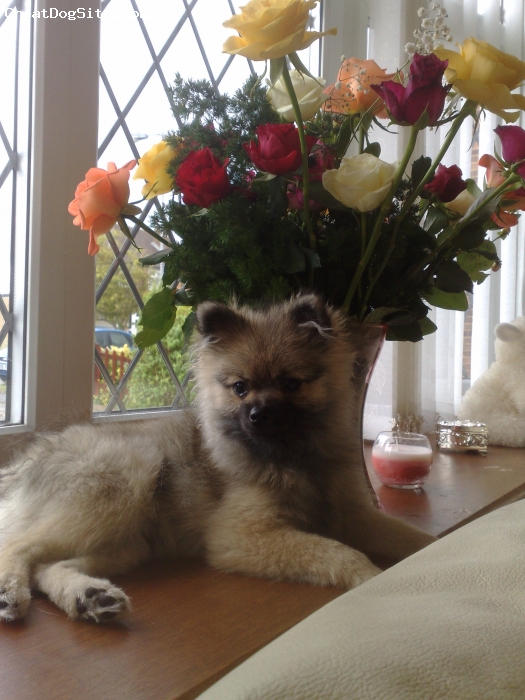
The image size is (525, 700). Identify the location of lid of silver trinket box. (444, 426).